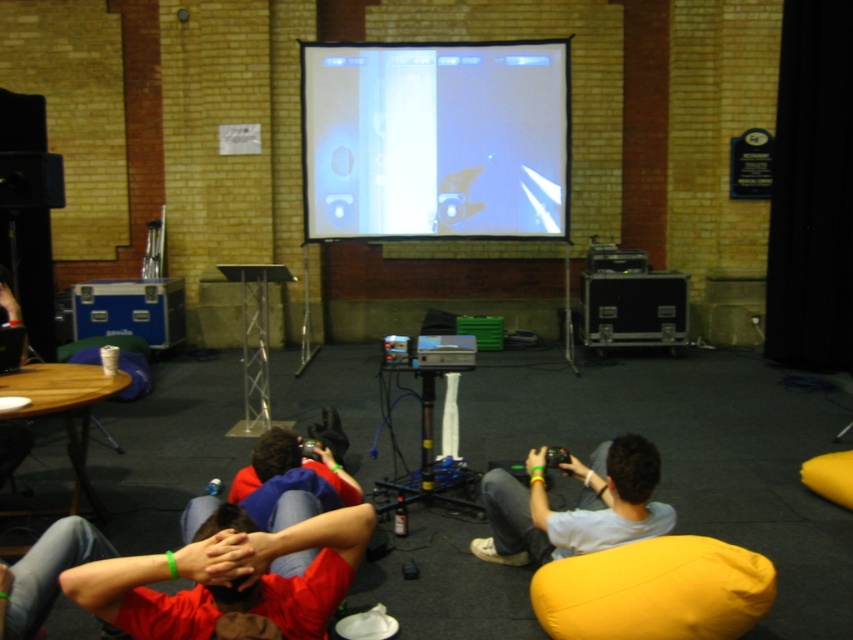
You are a photographer standing in the room and want to take a photo of the red fabric shirt at center and the yellow fabric bean bag at lower right. Which object will appear larger in the photo?

The red fabric shirt at center will appear larger in the photo because it is closer to the viewer than the yellow fabric bean bag at lower right.

You are standing in the room and want to pick up an object located at point (471, 224). Can you estimate how far you need to walk to reach it?

The point (471, 224) is 6.64 meters away from the viewer, so you need to walk approximately 6.64 meters to reach it.

You are a photographer taking a picture of the gaming scene. You notice the red fabric shirt at center and the light gray fabric shirt at center. Which shirt should you focus on first if you want to capture both shirts in the same frame without moving the camera?

The red fabric shirt at center is located below the light gray fabric shirt at center, so you should focus on the light gray fabric shirt at center first as it is higher in the frame.